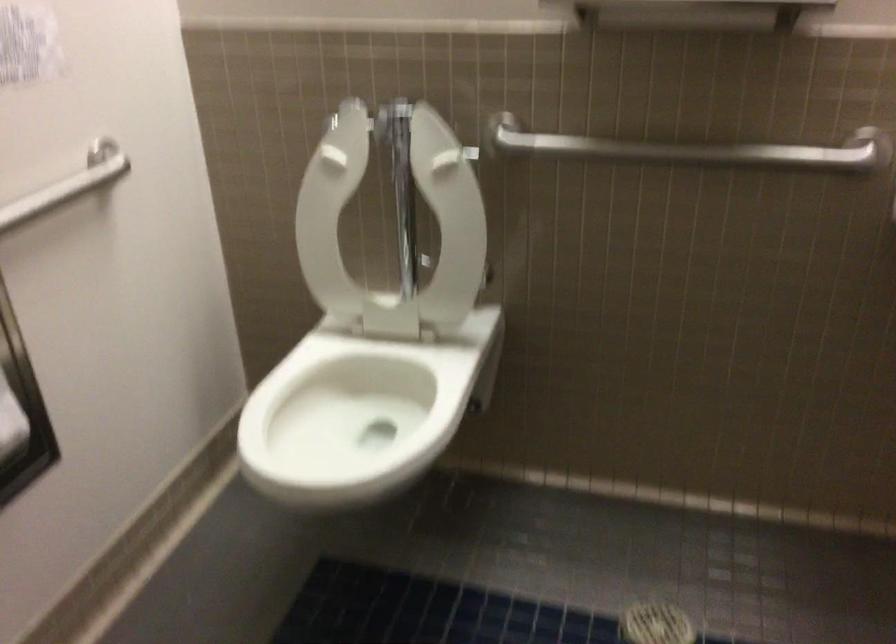
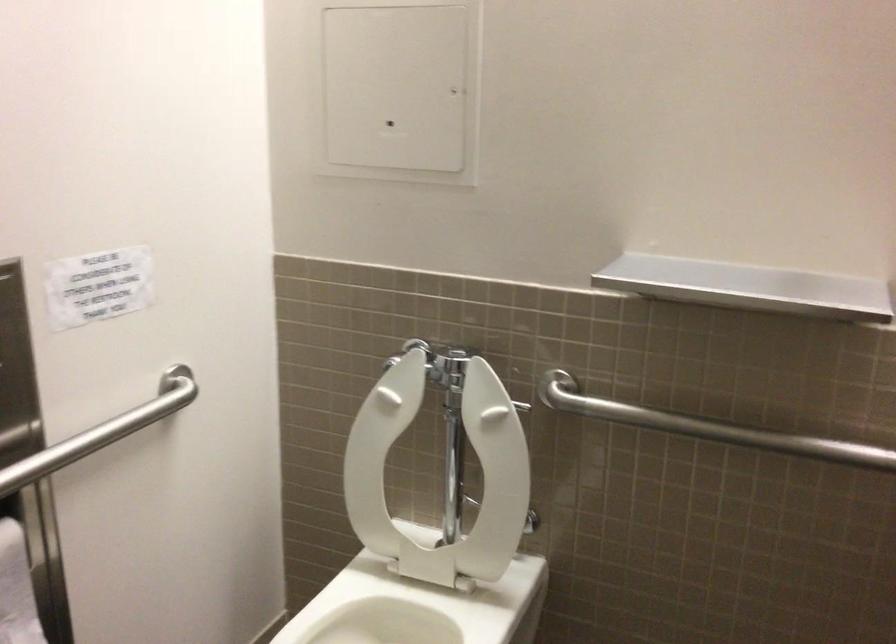
Where in the second image is the point corresponding to (389,236) from the first image?

(440, 474)